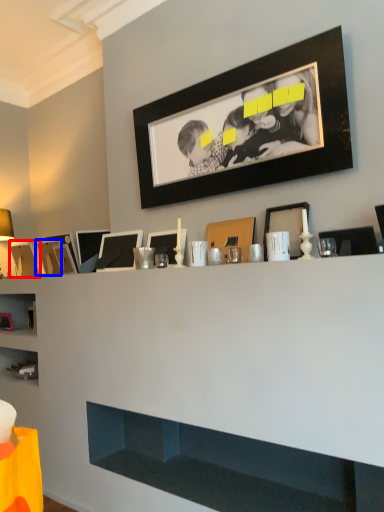
Question: Which object appears farthest to the camera in this image, picture frame (highlighted by a red box) or picture frame (highlighted by a blue box)?

Choices:
 (A) picture frame
 (B) picture frame

Answer: (A)